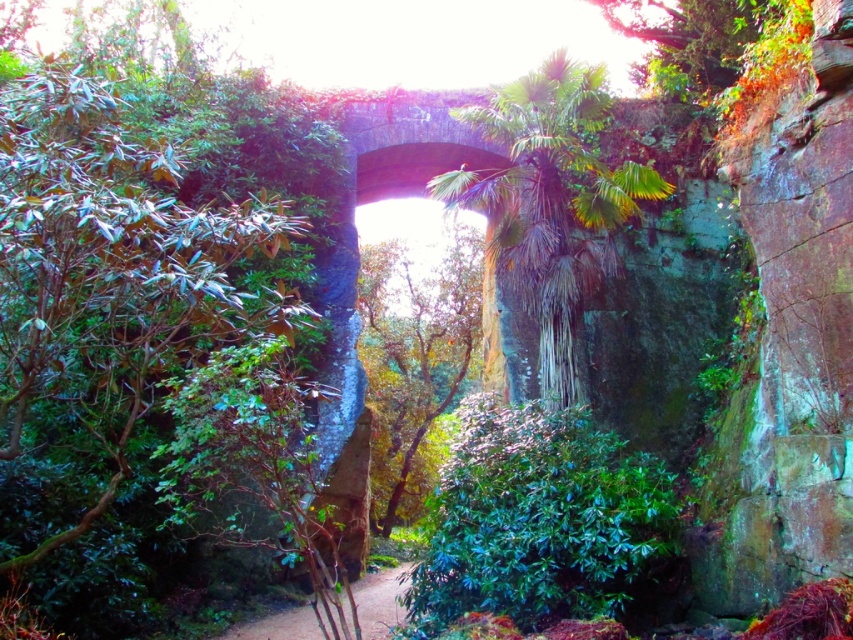
Who is positioned more to the left, green leafy tree at center or green leafy tree at upper center?

From the viewer's perspective, green leafy tree at center appears more on the left side.

Does green leafy tree at center appear on the left side of green leafy tree at upper center?

Correct, you'll find green leafy tree at center to the left of green leafy tree at upper center.

Does point (376, 342) come farther from viewer compared to point (732, 12)?

Yes, it is.

At what (x,y) coordinates should I click in order to perform the action: click on green leafy tree at center. Please return your answer as a coordinate pair (x, y). The width and height of the screenshot is (853, 640). Looking at the image, I should click on (415, 360).

Is green leafy palm at center taller than green leafy tree at upper center?

Yes.

Between green leafy palm at center and green leafy tree at upper center, which one appears on the right side from the viewer's perspective?

green leafy tree at upper center

Which is behind, point (645, 182) or point (798, 13)?

The point (645, 182) is more distant.

Where is `green leafy palm at center`? green leafy palm at center is located at coordinates (x=550, y=202).

Who is more forward, (605, 538) or (381, 577)?

Point (605, 538)

Is point (480, 499) positioned behind point (364, 636)?

No, (480, 499) is in front of (364, 636).

Is point (442, 493) farther from viewer compared to point (299, 616)?

That is False.

Where is `green glossy bush at center`? The width and height of the screenshot is (853, 640). green glossy bush at center is located at coordinates (537, 520).